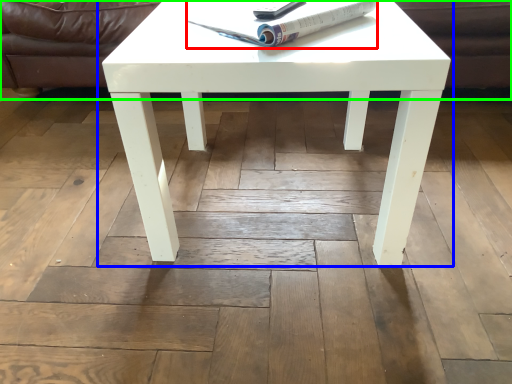
Question: Considering the real-world distances, which object is closest to magazine (highlighted by a red box)? coffee table (highlighted by a blue box) or couch (highlighted by a green box).

Choices:
 (A) coffee table
 (B) couch

Answer: (A)